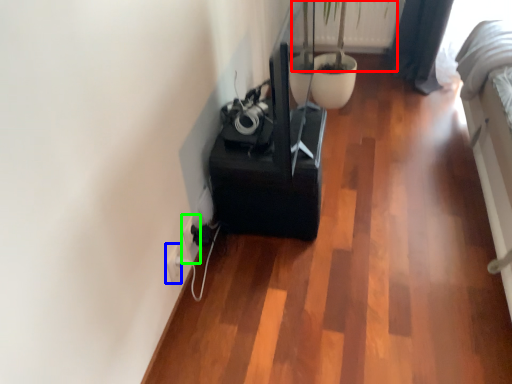
Question: Considering the real-world distances, which object is farthest from plant (highlighted by a red box)? electric outlet (highlighted by a blue box) or electric outlet (highlighted by a green box)?

Choices:
 (A) electric outlet
 (B) electric outlet

Answer: (A)